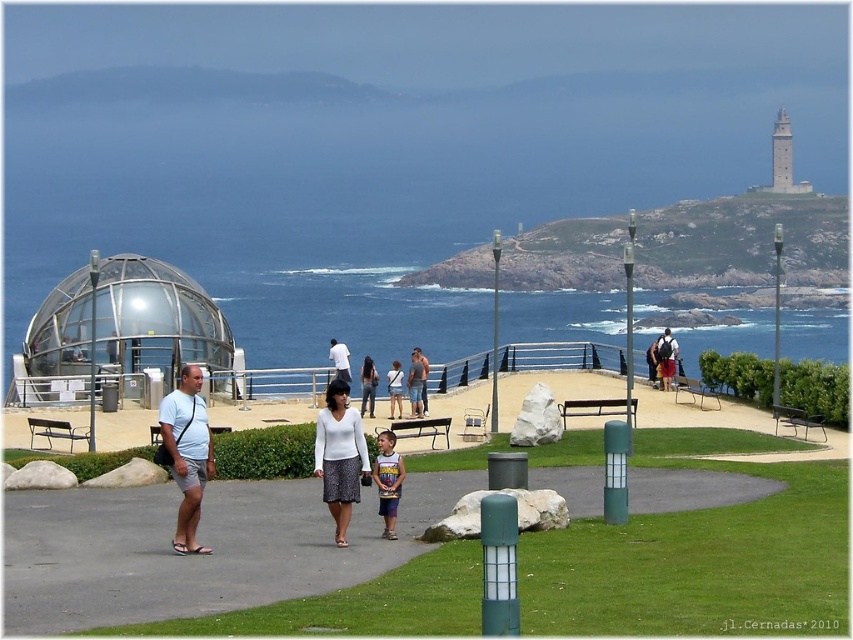
Question: Considering the relative positions of green asphalt path at center and light blue shirt at center in the image provided, where is green asphalt path at center located with respect to light blue shirt at center?

Choices:
 (A) below
 (B) above

Answer: (A)

Question: Does transparent glass water at center have a larger size compared to light blue shirt at center?

Choices:
 (A) no
 (B) yes

Answer: (B)

Question: Does green asphalt path at center appear on the right side of white cotton t-shirt at center?

Choices:
 (A) no
 (B) yes

Answer: (B)

Question: Which object is positioned farthest from the matte white shirt at center?

Choices:
 (A) white matte sweater at center
 (B) light blue shirt at center
 (C) striped t-shirt at center
 (D) green asphalt path at center

Answer: (C)

Question: Which of the following is the closest to the observer?

Choices:
 (A) (671, 362)
 (B) (210, 449)
 (C) (341, 372)

Answer: (B)

Question: Among these points, which one is farthest from the camera?

Choices:
 (A) (410, 365)
 (B) (277, 552)
 (C) (515, 301)
 (D) (332, 513)

Answer: (C)